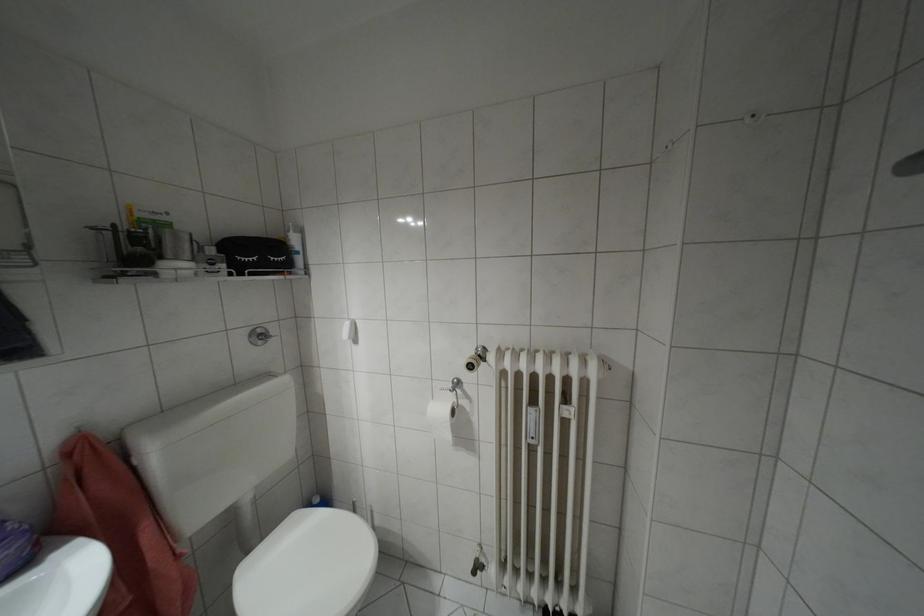
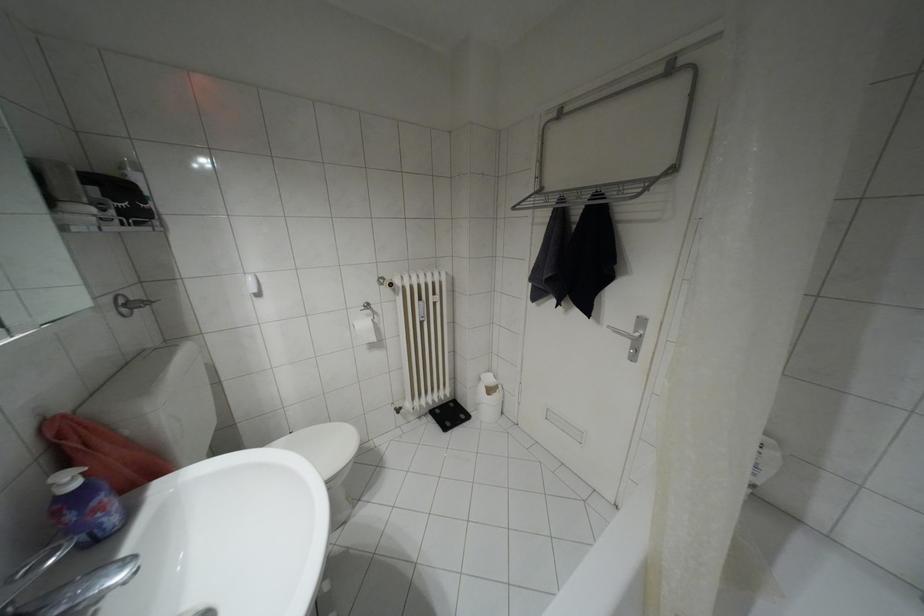
Question: The images are taken continuously from a first-person perspective. In which direction is your viewpoint rotating?

Choices:
 (A) Left
 (B) Right
 (C) Up
 (D) Down

Answer: (B)